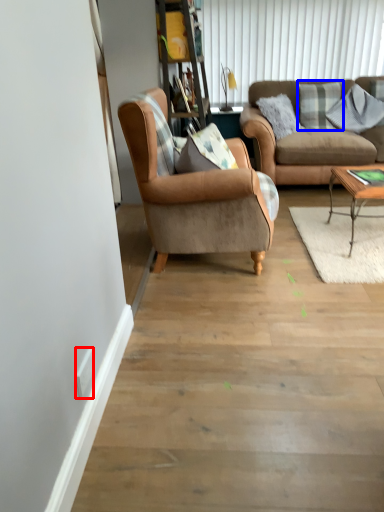
Question: Which object is further to the camera taking this photo, power outlet (highlighted by a red box) or pillow (highlighted by a blue box)?

Choices:
 (A) power outlet
 (B) pillow

Answer: (B)